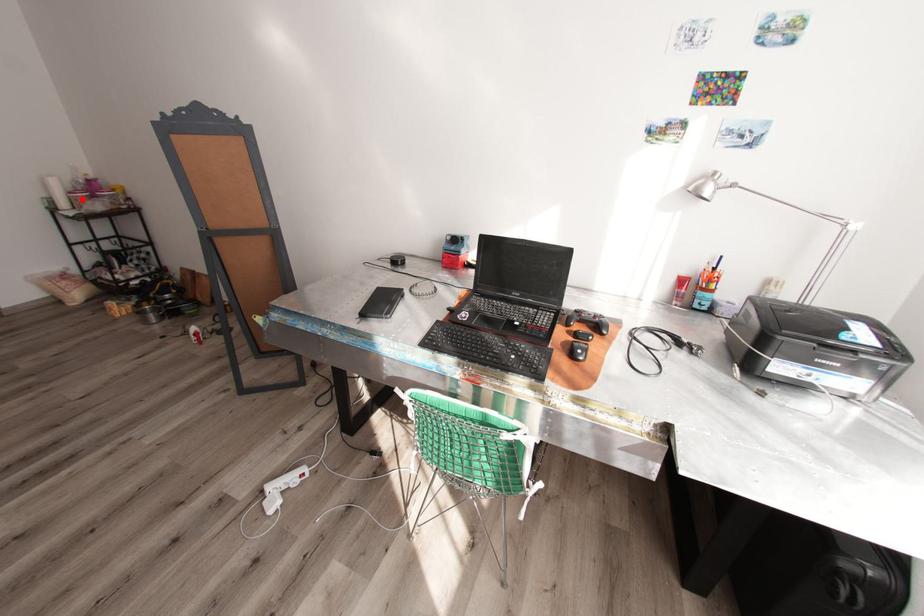
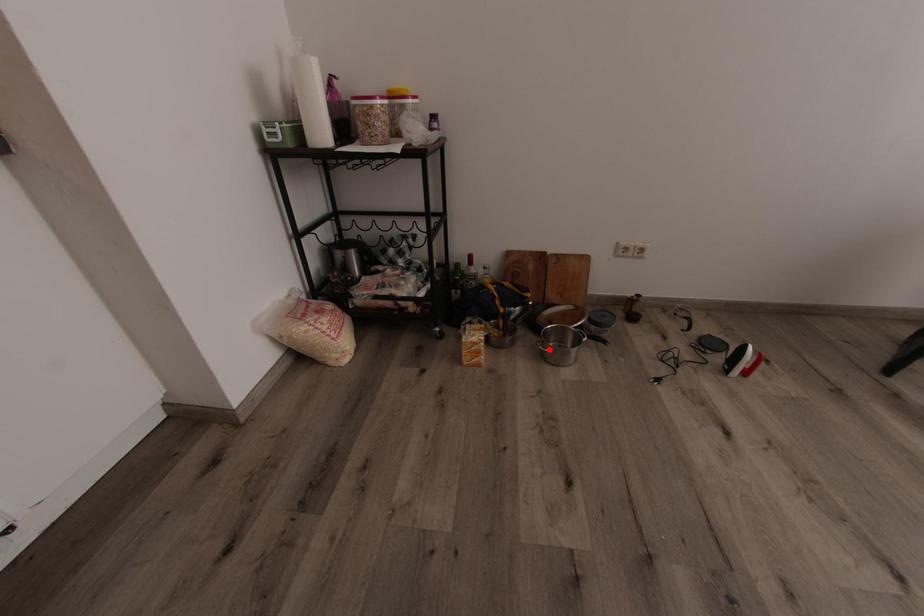
I am providing you with two images of the same scene from different viewpoints. A red point is marked on the first image and another point is marked on the second image. Are the points marked in image1 and image2 representing the same 3D position?

No